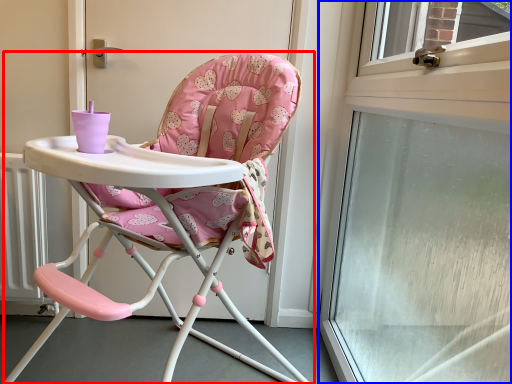
Question: Among these objects, which one is farthest to the camera, chair (highlighted by a red box) or window (highlighted by a blue box)?

Choices:
 (A) chair
 (B) window

Answer: (A)